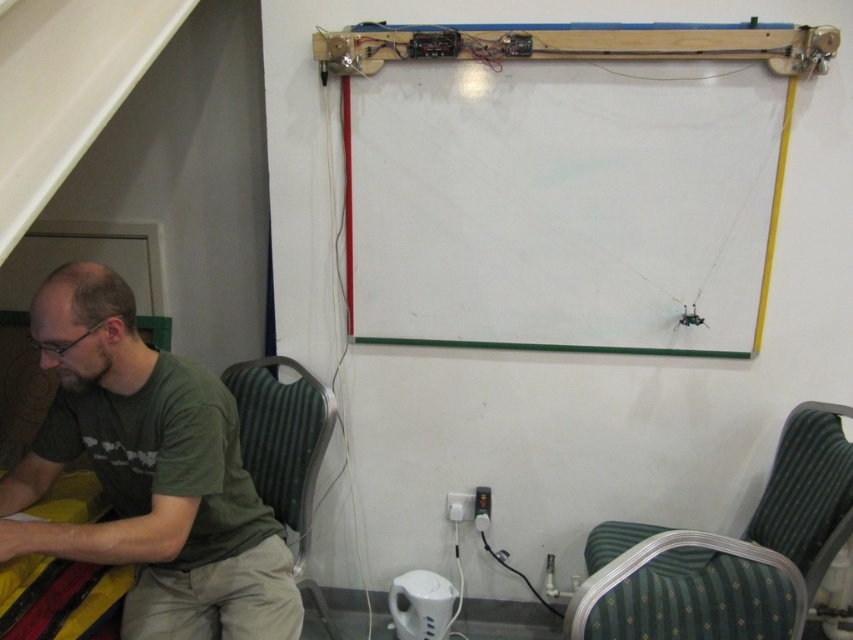
Does green fabric chair at lower right have a smaller size compared to green fabric chair at lower left?

No.

Describe the element at coordinates (728, 554) in the screenshot. I see `green fabric chair at lower right` at that location.

Image resolution: width=853 pixels, height=640 pixels. What do you see at coordinates (728, 554) in the screenshot? I see `green fabric chair at lower right` at bounding box center [728, 554].

You are a GUI agent. You are given a task and a screenshot of the screen. Output one action in this format:
    pyautogui.click(x=<x>, y=<y>)
    Task: Click on the green fabric chair at lower right
    Image resolution: width=853 pixels, height=640 pixels.
    Given the screenshot: What is the action you would take?
    pyautogui.click(x=728, y=554)

Does green fabric chair at lower left have a larger size compared to yellow striped fabric at lower left?

Yes, green fabric chair at lower left is bigger than yellow striped fabric at lower left.

Based on the photo, is green fabric chair at lower left closer to camera compared to yellow striped fabric at lower left?

No, it is behind yellow striped fabric at lower left.

The width and height of the screenshot is (853, 640). Identify the location of green fabric chair at lower left. coord(283,449).

Who is positioned more to the left, green cotton shirt at lower left or yellow striped fabric at lower left?

From the viewer's perspective, yellow striped fabric at lower left appears more on the left side.

Which of these two, green cotton shirt at lower left or yellow striped fabric at lower left, stands taller?

green cotton shirt at lower left is taller.

Describe the element at coordinates (149, 474) in the screenshot. This screenshot has width=853, height=640. I see `green cotton shirt at lower left` at that location.

Locate an element on the screen. This screenshot has height=640, width=853. green cotton shirt at lower left is located at coordinates (149, 474).